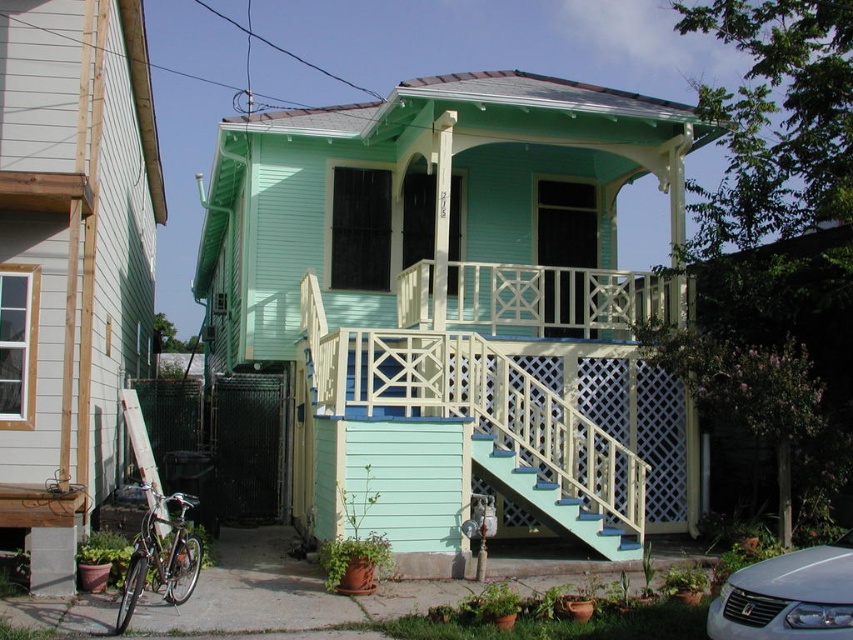
Does satin silver sedan at lower right come behind teal painted wood stairs at center?

No, satin silver sedan at lower right is closer to the viewer.

You are a GUI agent. You are given a task and a screenshot of the screen. Output one action in this format:
    pyautogui.click(x=<x>, y=<y>)
    Task: Click on the satin silver sedan at lower right
    
    Given the screenshot: What is the action you would take?
    pyautogui.click(x=788, y=596)

The image size is (853, 640). Identify the location of satin silver sedan at lower right. (x=788, y=596).

Is point (610, 426) positioned after point (795, 570)?

Yes, it is.

Who is positioned more to the right, light blue wood stairs at center or satin silver sedan at lower right?

Positioned to the right is satin silver sedan at lower right.

Does point (573, 368) lie in front of point (817, 598)?

No, it is behind (817, 598).

This screenshot has width=853, height=640. I want to click on light blue wood stairs at center, so click(x=473, y=428).

Which is behind, point (566, 396) or point (630, 540)?

The point (566, 396) is more distant.

Is light blue wood stairs at center behind teal painted wood stairs at center?

No.

Measure the distance between point [531,282] and camera.

A distance of 11.40 meters exists between point [531,282] and camera.

Image resolution: width=853 pixels, height=640 pixels. Identify the location of light blue wood stairs at center. (473, 428).